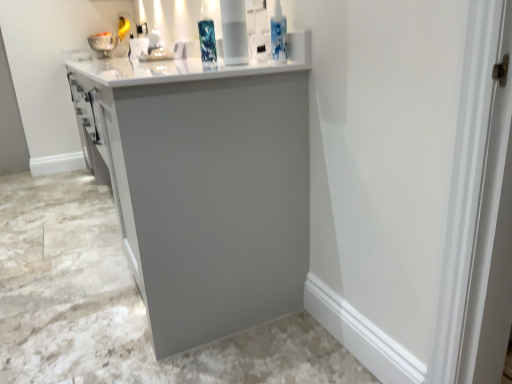
Question: From the image's perspective, is white glossy vase at upper center located beneath white glossy sink at upper center?

Choices:
 (A) yes
 (B) no

Answer: (A)

Question: Can you confirm if white glossy vase at upper center is bigger than white glossy sink at upper center?

Choices:
 (A) no
 (B) yes

Answer: (A)

Question: Is white glossy sink at upper center a part of white glossy vase at upper center?

Choices:
 (A) no
 (B) yes

Answer: (A)

Question: Is white glossy vase at upper center to the right of white glossy sink at upper center from the viewer's perspective?

Choices:
 (A) yes
 (B) no

Answer: (A)

Question: From a real-world perspective, is white glossy vase at upper center physically below white glossy sink at upper center?

Choices:
 (A) yes
 (B) no

Answer: (B)

Question: Considering the positions of white glossy sink at upper center and white glossy vase at upper center in the image, is white glossy sink at upper center wider or thinner than white glossy vase at upper center?

Choices:
 (A) wide
 (B) thin

Answer: (A)

Question: Do you think white glossy sink at upper center is within white glossy vase at upper center, or outside of it?

Choices:
 (A) outside
 (B) inside

Answer: (A)

Question: From the image's perspective, is white glossy sink at upper center positioned above or below white glossy vase at upper center?

Choices:
 (A) above
 (B) below

Answer: (A)

Question: From a real-world perspective, relative to white glossy vase at upper center, is white glossy sink at upper center vertically above or below?

Choices:
 (A) below
 (B) above

Answer: (A)

Question: Is white glossy vase at upper center inside or outside of matte gray cabinet at center?

Choices:
 (A) outside
 (B) inside

Answer: (B)

Question: Is white glossy vase at upper center bigger or smaller than matte gray cabinet at center?

Choices:
 (A) big
 (B) small

Answer: (B)

Question: Does point (227, 11) appear closer or farther from the camera than point (259, 198)?

Choices:
 (A) closer
 (B) farther

Answer: (A)

Question: From a real-world perspective, is white glossy vase at upper center physically located above or below matte gray cabinet at center?

Choices:
 (A) above
 (B) below

Answer: (A)

Question: Is matte gray cabinet at center inside the boundaries of white glossy vase at upper center, or outside?

Choices:
 (A) outside
 (B) inside

Answer: (A)

Question: Looking at their shapes, would you say matte gray cabinet at center is wider or thinner than white glossy vase at upper center?

Choices:
 (A) wide
 (B) thin

Answer: (A)